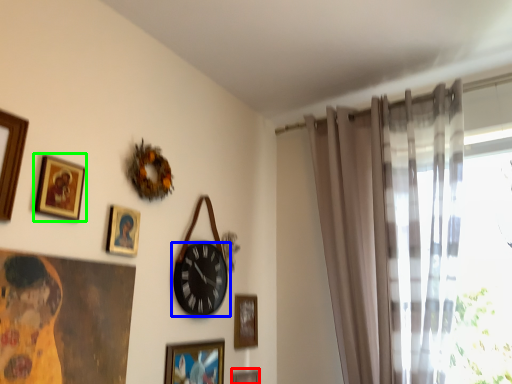
Question: Estimate the real-world distances between objects in this image. Which object is farther from picture frame (highlighted by a red box), wall clock (highlighted by a blue box) or picture frame (highlighted by a green box)?

Choices:
 (A) wall clock
 (B) picture frame

Answer: (B)